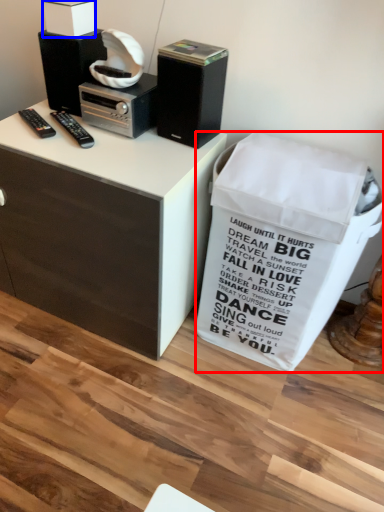
Question: Among these objects, which one is nearest to the camera, trash bin/can (highlighted by a red box) or box (highlighted by a blue box)?

Choices:
 (A) trash bin/can
 (B) box

Answer: (A)